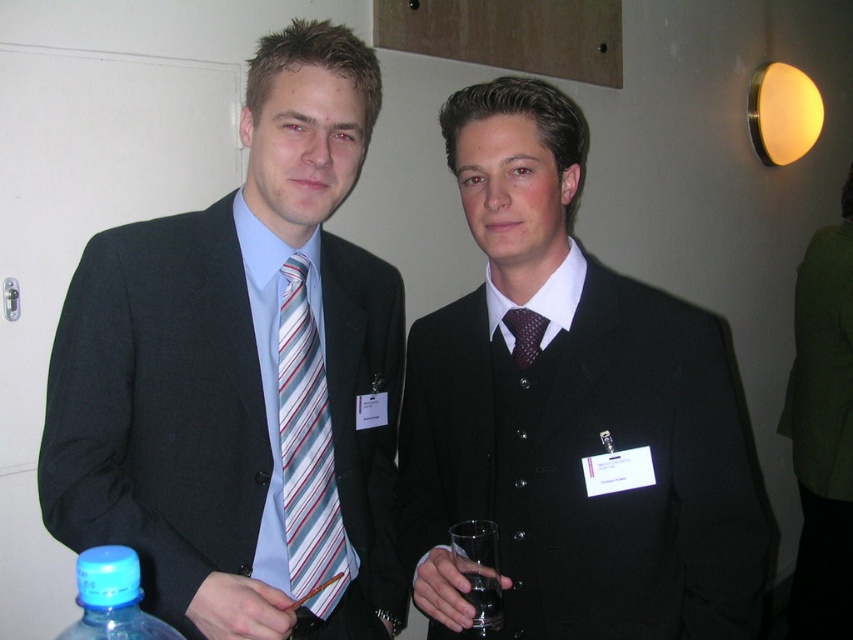
You are standing in the room and want to move from the point at coordinates point (115, 621) to the point at coordinates point (488, 582). Can you walk directly between them without any obstacles?

Point (115, 621) is in front of point (488, 582), so there might be an obstacle between them. Therefore, you cannot walk directly between them without any obstacles.

You are standing in front of the image and want to locate the matte black suit at left. Can you tell me its exact position in the image?

The matte black suit at left is located at point (242,378) in the image.

Looking at this image, you are organizing a formal event and need to arrange items on a shelf. The shelf has limited vertical space. Given the height difference between the matte black suit at center and blue plastic bottle at lower left, which item should you place first to maximize shelf space efficiency?

The matte black suit at center is taller than the blue plastic bottle at lower left, so place the blue plastic bottle at lower left first to utilize the shelf space efficiently.